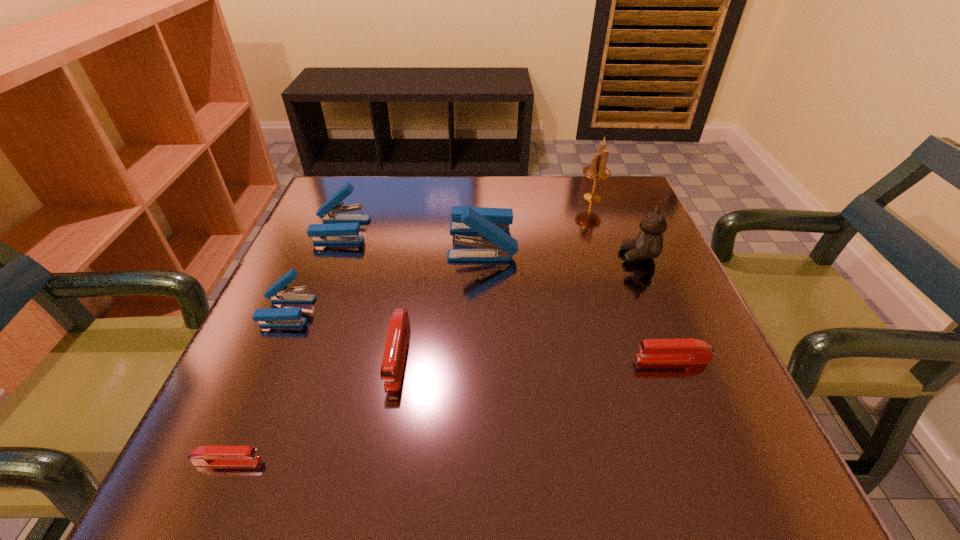
Where is `the tallest object`? This screenshot has height=540, width=960. the tallest object is located at coordinates (597, 170).

Locate an element on the screen. candle holder is located at coordinates (597, 170).

Where is `the biggest blue stapler`? the biggest blue stapler is located at coordinates (492, 224).

What are the coordinates of `the fifth object from left to right` in the screenshot? It's located at (492, 224).

At what (x,y) coordinates should I click in order to perform the action: click on teddy bear. Please return your answer as a coordinate pair (x, y). The height and width of the screenshot is (540, 960). Looking at the image, I should click on (648, 245).

At what (x,y) coordinates should I click in order to perform the action: click on the second smallest blue stapler. Please return your answer as a coordinate pair (x, y). Looking at the image, I should click on (344, 228).

This screenshot has height=540, width=960. In order to click on the second tallest stapler in this screenshot , I will do `click(344, 228)`.

Find the location of a particular element. Image resolution: width=960 pixels, height=540 pixels. the fourth shortest stapler is located at coordinates (279, 292).

Find the location of `the nearest blue stapler`. the nearest blue stapler is located at coordinates (279, 292).

What are the coordinates of `the fourth stapler from left to right` in the screenshot? It's located at (392, 364).